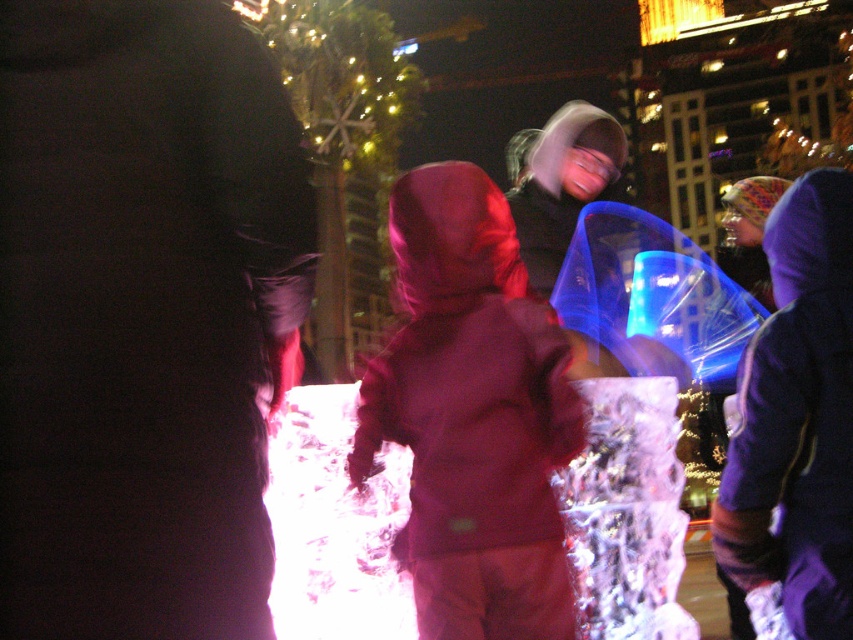
Question: Can you confirm if velvet-like maroon coat at center is wider than purple fleece jacket at right?

Choices:
 (A) no
 (B) yes

Answer: (B)

Question: Which is nearer to the velvet-like maroon coat at center?

Choices:
 (A) matte black jacket at center
 (B) purple fleece jacket at right

Answer: (B)

Question: Is the position of matte black jacket at center less distant than that of velvet-like maroon coat at center?

Choices:
 (A) no
 (B) yes

Answer: (B)

Question: Does matte black jacket at center have a larger size compared to velvet-like maroon coat at center?

Choices:
 (A) yes
 (B) no

Answer: (B)

Question: Which point is closer to the camera taking this photo?

Choices:
 (A) (71, 3)
 (B) (825, 477)
 (C) (461, 538)

Answer: (A)

Question: Which point appears farthest from the camera in this image?

Choices:
 (A) (485, 580)
 (B) (91, 291)
 (C) (828, 378)

Answer: (A)